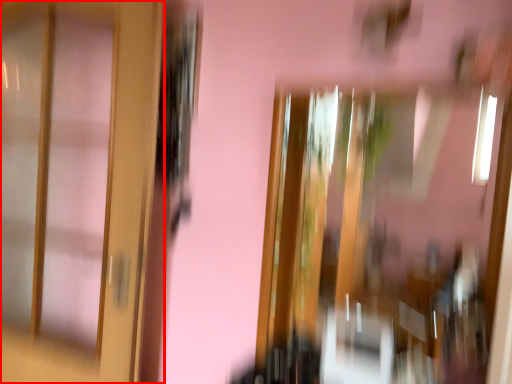
Question: From the image's perspective, what is the correct spatial relationship of door (annotated by the red box) in relation to window?

Choices:
 (A) above
 (B) below

Answer: (A)